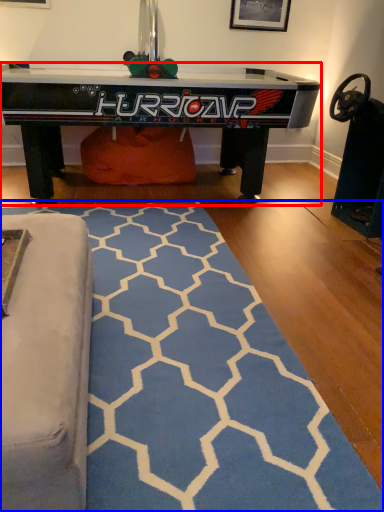
Question: Which object is closer to the camera taking this photo, table (highlighted by a red box) or mat (highlighted by a blue box)?

Choices:
 (A) table
 (B) mat

Answer: (B)